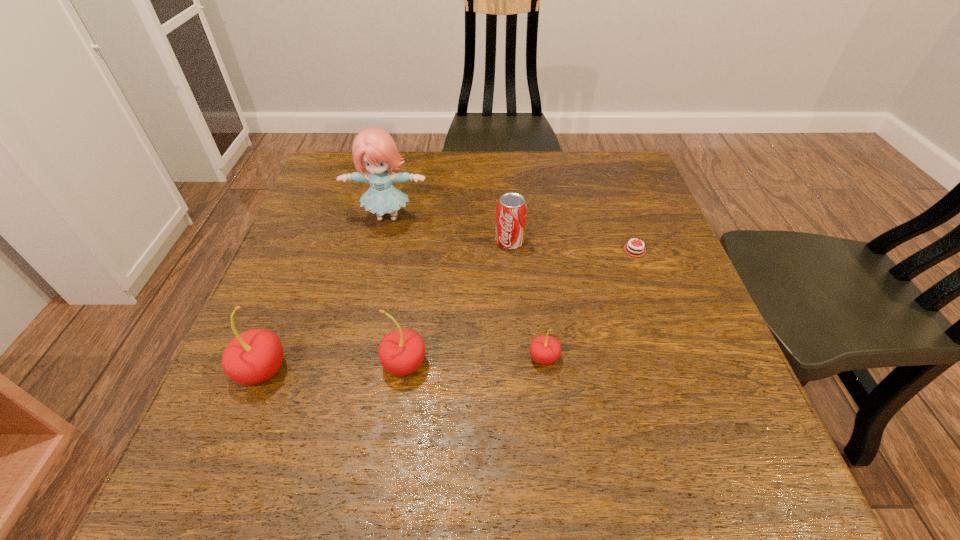
Find the location of a particular element. The image size is (960, 540). free space for a new cherry on the right is located at coordinates (681, 352).